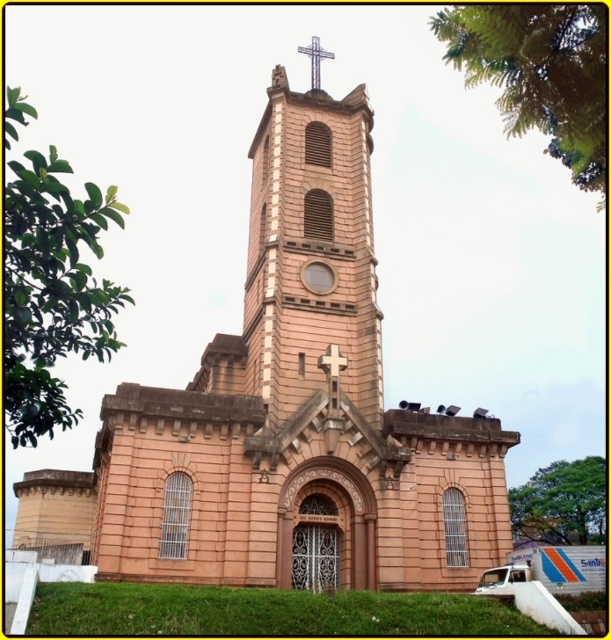
Can you confirm if matte brown clock at center is positioned below wooden cross at center?

Actually, matte brown clock at center is above wooden cross at center.

Between matte brown clock at center and wooden cross at center, which one appears on the right side from the viewer's perspective?

From the viewer's perspective, wooden cross at center appears more on the right side.

The width and height of the screenshot is (611, 640). What do you see at coordinates (316, 276) in the screenshot?
I see `matte brown clock at center` at bounding box center [316, 276].

The image size is (611, 640). In order to click on matte brown clock at center in this screenshot , I will do `click(316, 276)`.

Is point (312, 88) positioned before point (345, 356)?

No, it is behind (345, 356).

The width and height of the screenshot is (611, 640). In order to click on white metallic cross at upper center in this screenshot , I will do `click(315, 60)`.

Locate an element on the screen. The image size is (611, 640). white metallic cross at upper center is located at coordinates (315, 60).

The image size is (611, 640). I want to click on white metallic cross at upper center, so click(x=315, y=60).

Who is more forward, (337, 241) or (316, 88)?

Positioned in front is point (337, 241).

Does pink stone bell tower at center have a larger size compared to white metallic cross at upper center?

Yes.

The width and height of the screenshot is (611, 640). Describe the element at coordinates (312, 248) in the screenshot. I see `pink stone bell tower at center` at that location.

Where is `pink stone bell tower at center`? This screenshot has width=611, height=640. pink stone bell tower at center is located at coordinates (312, 248).